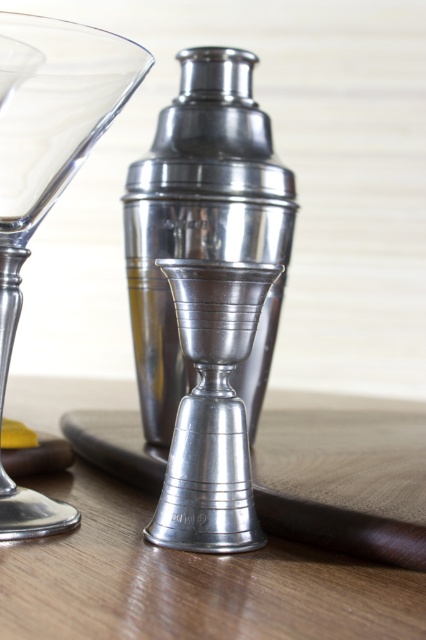
Question: Among these objects, which one is farthest from the camera?

Choices:
 (A) metallic silver cup at lower center
 (B) clear glass wine glass at left

Answer: (B)

Question: Does metallic silver cup at lower center have a lesser width compared to clear glass wine glass at left?

Choices:
 (A) yes
 (B) no

Answer: (B)

Question: Is metallic silver cup at lower center to the left of clear glass wine glass at left from the viewer's perspective?

Choices:
 (A) no
 (B) yes

Answer: (A)

Question: Is metallic silver cup at lower center closer to the viewer compared to clear glass wine glass at left?

Choices:
 (A) yes
 (B) no

Answer: (A)